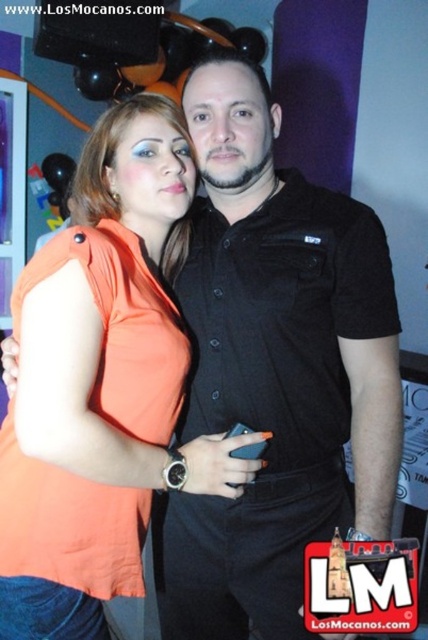
Question: In this image, where is black matte shirt at center located relative to orange fabric dress at center?

Choices:
 (A) below
 (B) above

Answer: (B)

Question: From the image, what is the correct spatial relationship of black matte shirt at center in relation to orange fabric dress at center?

Choices:
 (A) left
 (B) right

Answer: (B)

Question: Which of the following is the closest to the observer?

Choices:
 (A) (272, 524)
 (B) (146, 502)

Answer: (B)

Question: Which of the following is the closest to the observer?

Choices:
 (A) (235, 412)
 (B) (143, 524)

Answer: (B)

Question: In this image, where is black matte shirt at center located relative to orange fabric dress at center?

Choices:
 (A) left
 (B) right

Answer: (B)